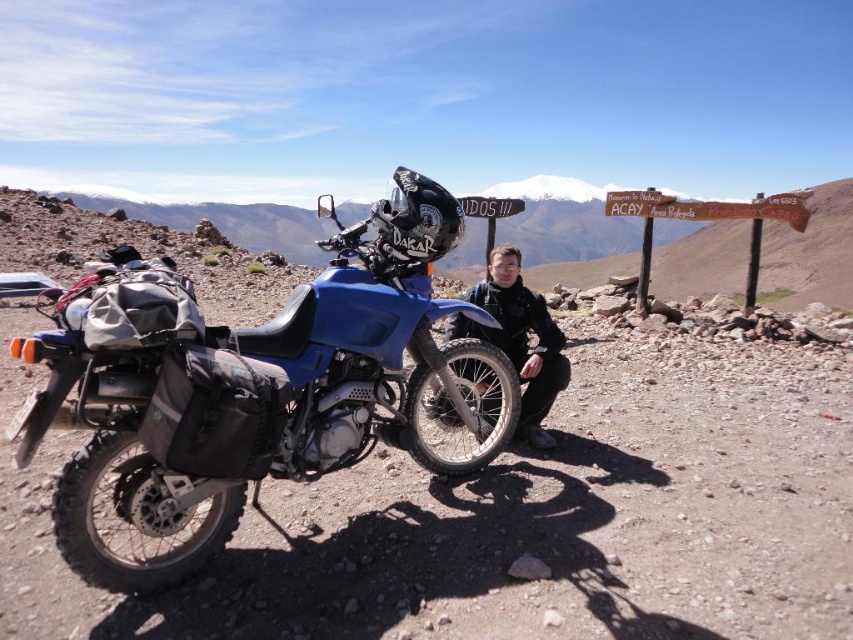
Question: Is blue rubber tire at lower left wider than black matte jacket at center?

Choices:
 (A) no
 (B) yes

Answer: (B)

Question: Is blue matte/synthetic motorcycle at center wider than black matte jacket at center?

Choices:
 (A) yes
 (B) no

Answer: (A)

Question: Which point is closer to the camera taking this photo?

Choices:
 (A) (613, 604)
 (B) (540, 392)
 (C) (352, 346)

Answer: (A)

Question: Which of the following is the closest to the observer?

Choices:
 (A) (514, 250)
 (B) (367, 435)

Answer: (B)

Question: Is blue rubber tire at lower left wider than black matte jacket at center?

Choices:
 (A) yes
 (B) no

Answer: (A)

Question: Which point appears farthest from the camera in this image?

Choices:
 (A) (140, 269)
 (B) (294, 618)

Answer: (A)